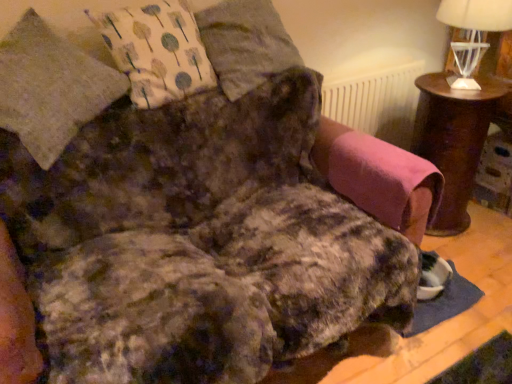
Question: From the image's perspective, is white textured radiator at upper center located above or below fluffy gray pillow at upper center, which is counted as the 2th pillow, starting from the left?

Choices:
 (A) below
 (B) above

Answer: (A)

Question: From a real-world perspective, is white textured radiator at upper center physically located above or below fluffy gray pillow at upper center, the 1th pillow positioned from the right?

Choices:
 (A) below
 (B) above

Answer: (A)

Question: Considering the real-world distances, which object is farthest from the brown wooden table at right?

Choices:
 (A) white fabric with tree pattern at upper left
 (B) fluffy gray pillow at upper center, the 1th pillow positioned from the right
 (C) pink fabric swivel chair at right
 (D) fluffy gray pillow at upper left, which is the first pillow in left-to-right order
 (E) white glass table lamp at upper right

Answer: (D)

Question: Based on their relative distances, which object is nearer to the white glass table lamp at upper right?

Choices:
 (A) white fabric with tree pattern at upper left
 (B) white textured radiator at upper center
 (C) fluffy gray pillow at upper left, which is the first pillow in left-to-right order
 (D) pink fabric swivel chair at right
 (E) brown wooden table at right

Answer: (E)